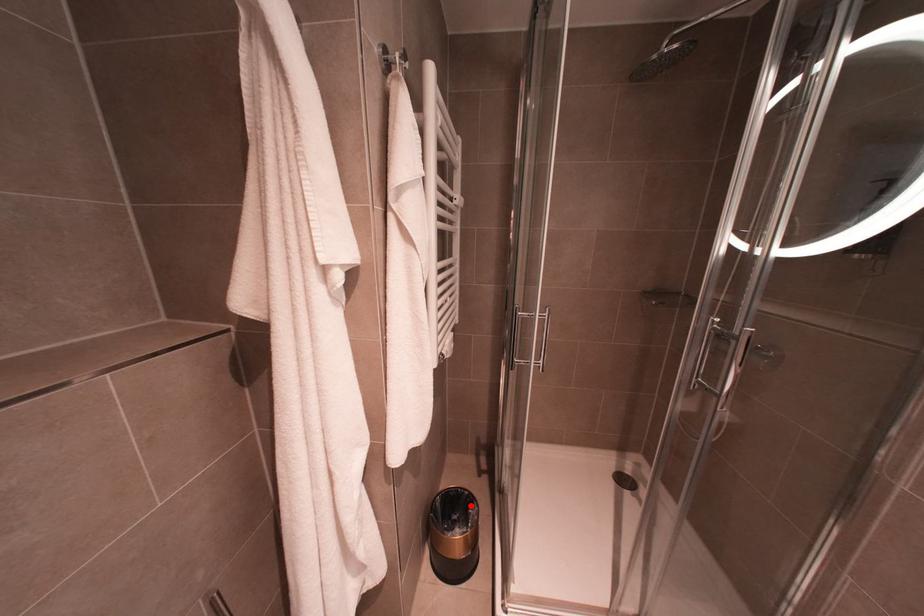
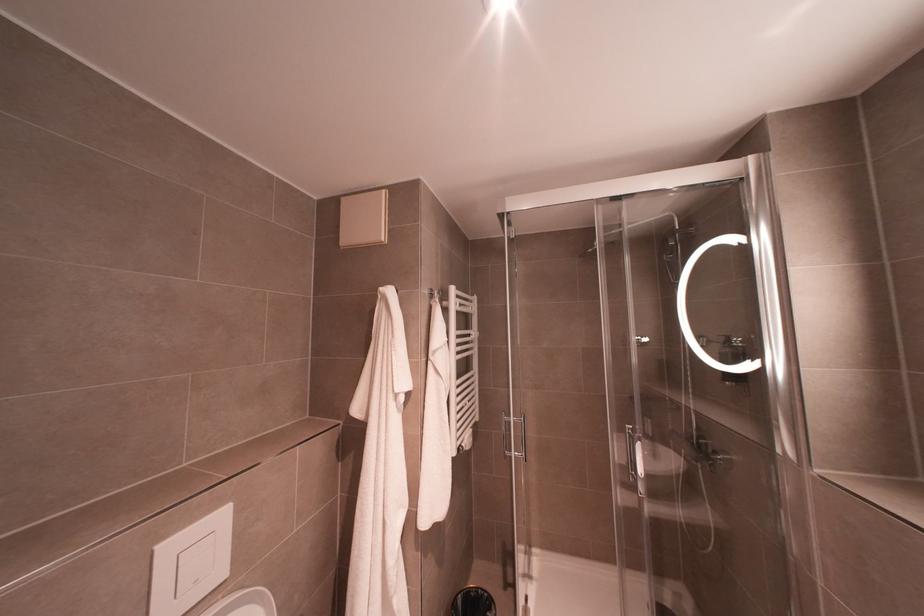
In the second image, find the point that corresponds to the highlighted location in the first image.

(489, 608)